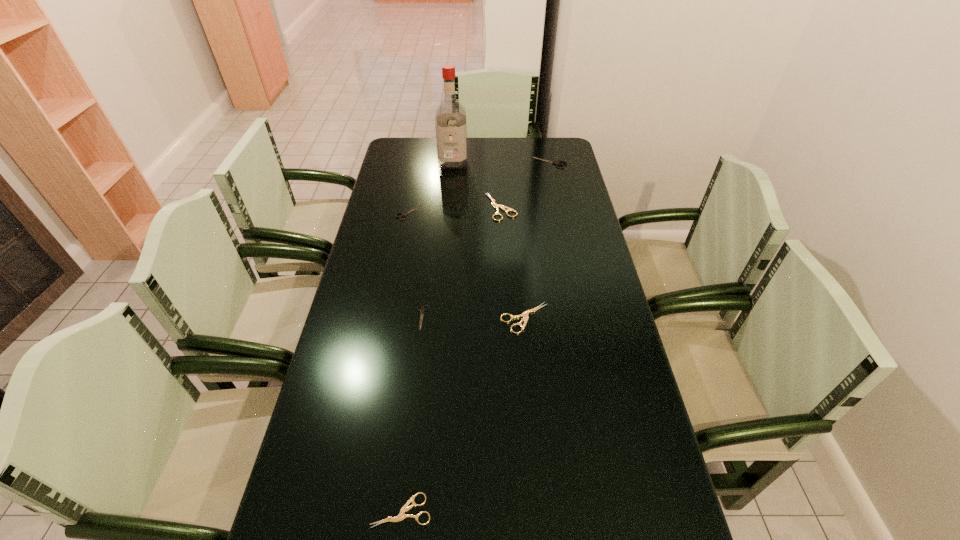
I want to click on the smallest black shears, so click(422, 310).

Identify the location of free location located 0.310m on the front-facing side of the liquor. (448, 215).

Locate an element on the screen. The image size is (960, 540). vacant space located 0.050m on the back of the rightmost black shears is located at coordinates (547, 151).

Locate an element on the screen. vacant area located 0.260m on the back of the biggest beige shears is located at coordinates (498, 159).

This screenshot has width=960, height=540. Find the location of `free point located 0.230m on the front of the second biggest black shears`. free point located 0.230m on the front of the second biggest black shears is located at coordinates [x=399, y=265].

Find the location of a particular element. free region located 0.310m on the front of the second nearest beige shears is located at coordinates (537, 442).

Locate an element on the screen. The width and height of the screenshot is (960, 540). free space located on the back of the leftmost beige shears is located at coordinates (414, 403).

Locate an element on the screen. This screenshot has height=540, width=960. vacant space located on the right of the second black shears from right to left is located at coordinates (504, 318).

Identify the location of liquor present at the far edge. This screenshot has width=960, height=540. (450, 120).

Where is `shears at the far edge`? The width and height of the screenshot is (960, 540). shears at the far edge is located at coordinates (557, 163).